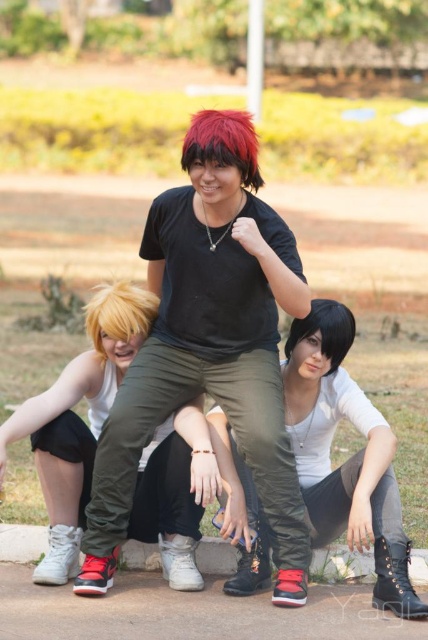
Question: Is matte black shirt at center thinner than matte white tank top at lower left?

Choices:
 (A) no
 (B) yes

Answer: (A)

Question: Which object is farther from the camera taking this photo?

Choices:
 (A) matte white tank top at lower left
 (B) shiny red wig at center
 (C) white matte shirt at center

Answer: (B)

Question: Is the position of matte white tank top at lower left more distant than that of blondehair at lower left?

Choices:
 (A) yes
 (B) no

Answer: (B)

Question: Which object is positioned closest to the black matte wig at center?

Choices:
 (A) white matte shirt at center
 (B) shiny red wig at center

Answer: (A)

Question: Is white matte shirt at center positioned in front of black matte wig at center?

Choices:
 (A) yes
 (B) no

Answer: (A)

Question: Which object appears closest to the camera in this image?

Choices:
 (A) matte black shirt at center
 (B) matte white tank top at lower left
 (C) black matte wig at center

Answer: (A)